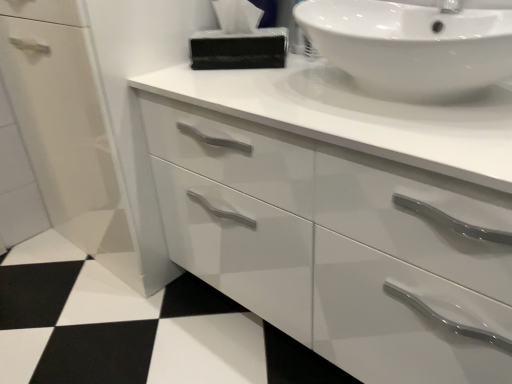
Locate an element on the screen. free space in front of black glossy tissue at upper center is located at coordinates (245, 75).